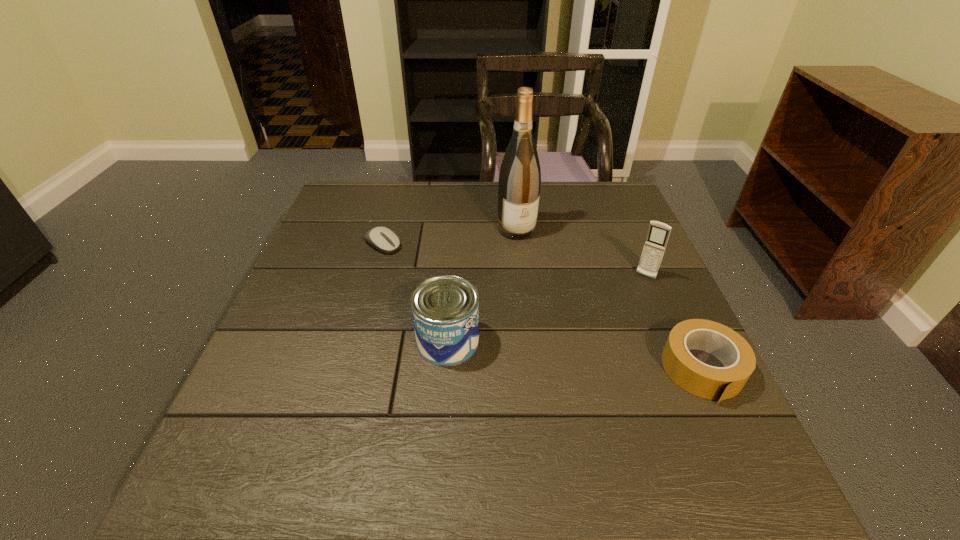
Locate an element on the screen. This screenshot has width=960, height=540. vacant area situated 0.080m on the front-facing side of the cellular telephone is located at coordinates (631, 300).

Where is `vacant area situated on the front-facing side of the cellular telephone`? vacant area situated on the front-facing side of the cellular telephone is located at coordinates (634, 295).

This screenshot has width=960, height=540. I want to click on blank area located 0.380m on the front-facing side of the cellular telephone, so [577, 389].

Find the location of a particular element. Image resolution: width=960 pixels, height=540 pixels. free space located on the label of the wine bottle is located at coordinates (566, 316).

Where is `blank space located on the label of the wine bottle`? The width and height of the screenshot is (960, 540). blank space located on the label of the wine bottle is located at coordinates (584, 346).

Locate an element on the screen. vacant space located on the label of the wine bottle is located at coordinates (560, 305).

At what (x,y) coordinates should I click in order to perform the action: click on vacant space located 0.230m on the wheel side of the computer equipment. Please return your answer as a coordinate pair (x, y). This screenshot has height=540, width=960. Looking at the image, I should click on (459, 289).

Where is `vacant space located 0.050m on the wheel side of the computer equipment`? The image size is (960, 540). vacant space located 0.050m on the wheel side of the computer equipment is located at coordinates (408, 259).

Image resolution: width=960 pixels, height=540 pixels. I want to click on vacant space located on the wheel side of the computer equipment, so click(444, 281).

At what (x,y) coordinates should I click in order to perform the action: click on object at the far edge. Please return your answer as a coordinate pair (x, y). The image size is (960, 540). Looking at the image, I should click on (519, 184).